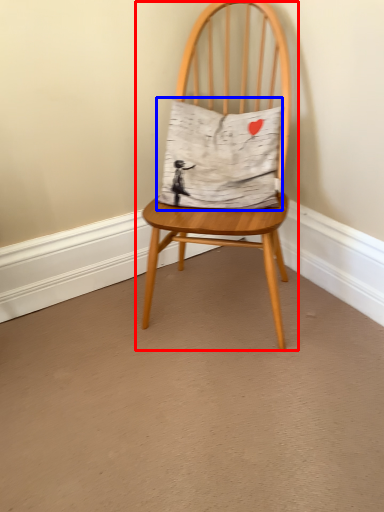
Question: Which point is closer to the camera, chair (highlighted by a red box) or pillow (highlighted by a blue box)?

Choices:
 (A) chair
 (B) pillow

Answer: (A)